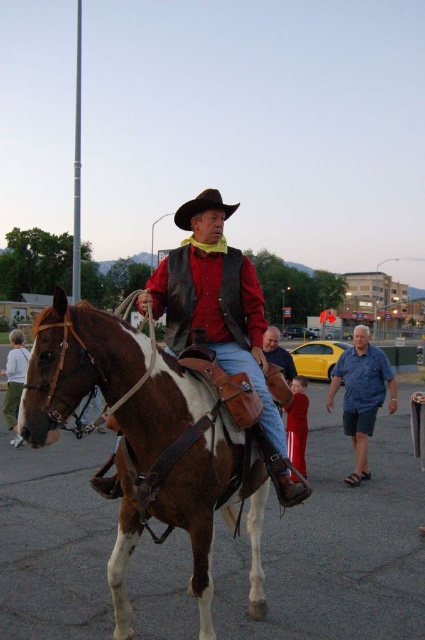
Question: Which object is closer to the camera taking this photo?

Choices:
 (A) brown leather cowboy hat at center
 (B) blue cotton shirt at center
 (C) brown leather horse at center
 (D) blue denim shirt at center

Answer: (C)

Question: Is brown leather horse at center closer to the viewer compared to light gray sweater at lower left?

Choices:
 (A) no
 (B) yes

Answer: (B)

Question: Observing the image, what is the correct spatial positioning of blue cotton shirt at center in reference to brown leather cowboy hat at center?

Choices:
 (A) below
 (B) above

Answer: (A)

Question: Which object is positioned farthest from the blue cotton shirt at center?

Choices:
 (A) light gray sweater at lower left
 (B) brown leather cowboy hat at center
 (C) brown leather horse at center

Answer: (A)

Question: Estimate the real-world distances between objects in this image. Which object is farther from the brown leather horse at center?

Choices:
 (A) light gray sweater at lower left
 (B) leather vest at center

Answer: (A)

Question: Is brown leather horse at center bigger than blue denim shirt at center?

Choices:
 (A) no
 (B) yes

Answer: (A)